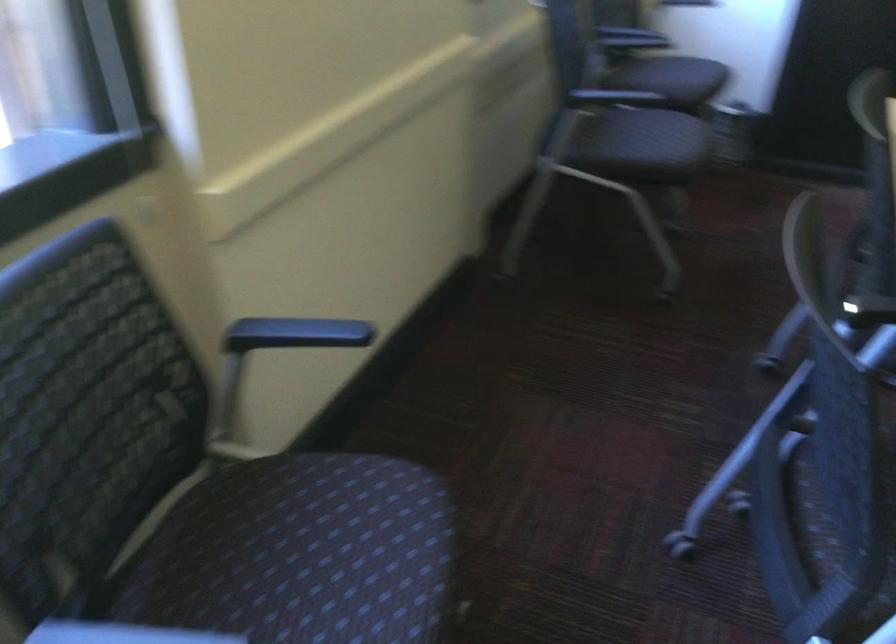
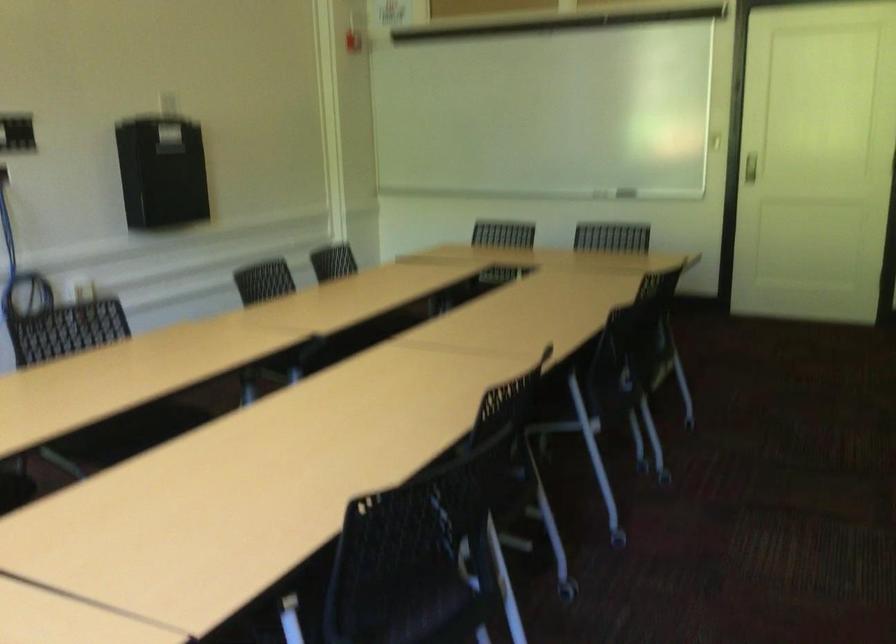
Question: The camera is either moving clockwise (left) or counter-clockwise (right) around the object. The first image is from the beginning of the video and the second image is from the end. Is the camera moving left or right when shooting the video?

Choices:
 (A) Left
 (B) Right

Answer: (A)